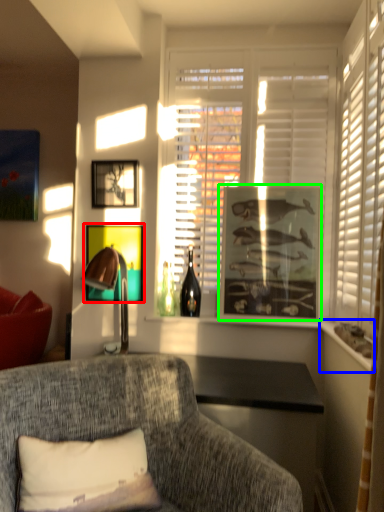
Question: Which object is positioned closest to picture frame (highlighted by a red box)? Select from window sill (highlighted by a blue box) and picture frame (highlighted by a green box).

Choices:
 (A) window sill
 (B) picture frame

Answer: (B)